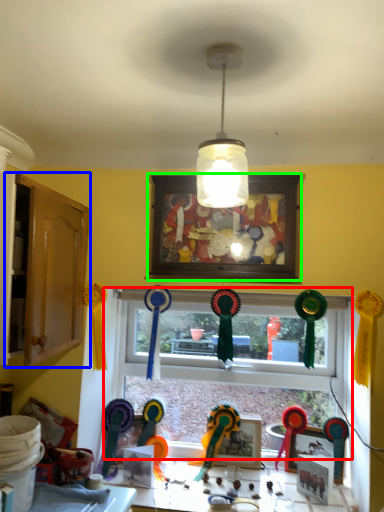
Question: Which object is the closest to the window (highlighted by a red box)? Choose among these: dresser (highlighted by a blue box) or picture frame (highlighted by a green box).

Choices:
 (A) dresser
 (B) picture frame

Answer: (B)